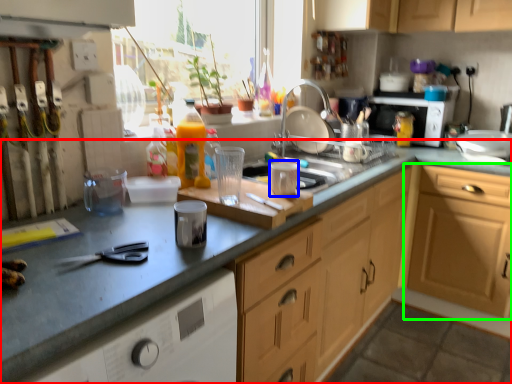
Question: Based on their relative distances, which object is farther from countertop (highlighted by a red box)? Choose from appliance (highlighted by a blue box) and cabinetry (highlighted by a green box).

Choices:
 (A) appliance
 (B) cabinetry

Answer: (B)